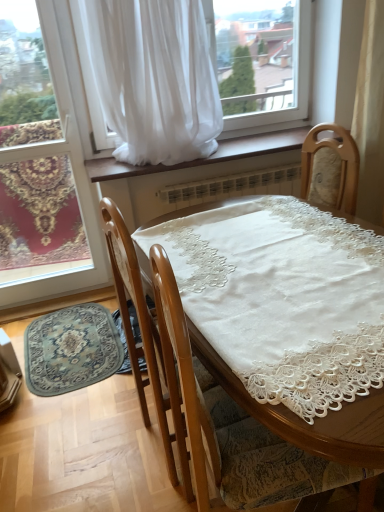
Question: In terms of height, does matte glass window at lower left look taller or shorter compared to wooden chair at center?

Choices:
 (A) tall
 (B) short

Answer: (A)

Question: Would you say matte glass window at lower left is inside or outside wooden chair at center?

Choices:
 (A) inside
 (B) outside

Answer: (B)

Question: Which object is the closest to the wooden chair at center?

Choices:
 (A) matte glass window at lower left
 (B) white sheer curtain at upper center
 (C) brown wood at center
 (D) blue patterned rug at lower left

Answer: (D)

Question: Which is farther from the matte glass window at lower left?

Choices:
 (A) white sheer curtain at upper center
 (B) brown wood at center
 (C) wooden chair at center
 (D) blue patterned rug at lower left

Answer: (C)